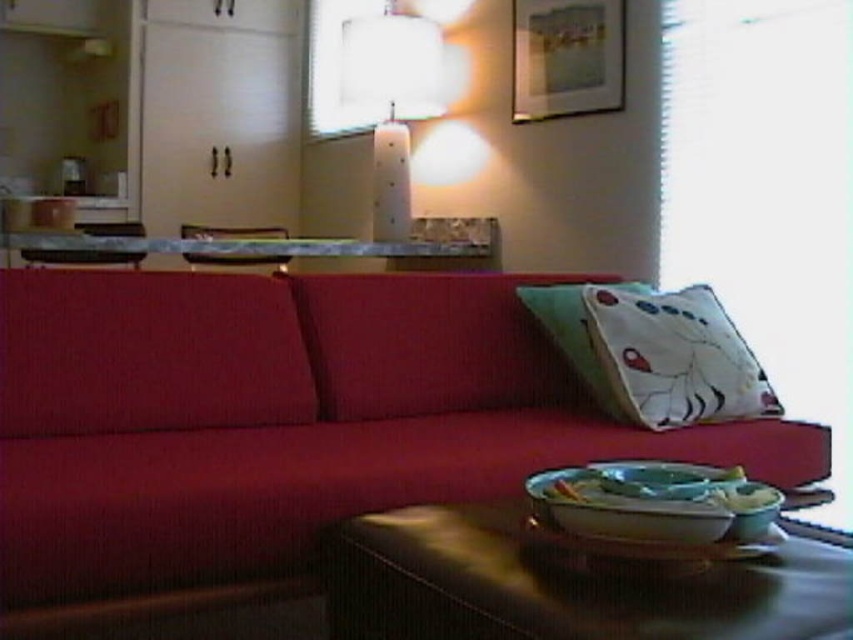
Which of these two, metallic silver table at center or white cotton pillow at right, stands taller?

white cotton pillow at right is taller.

Does point (486, 248) lie in front of point (601, 362)?

No, it is behind (601, 362).

Locate an element on the screen. This screenshot has height=640, width=853. metallic silver table at center is located at coordinates (242, 246).

Does velvet red couch at center lie behind white glossy lamp at upper center?

No, velvet red couch at center is in front of white glossy lamp at upper center.

Who is positioned more to the left, velvet red couch at center or white glossy lamp at upper center?

From the viewer's perspective, white glossy lamp at upper center appears more on the left side.

Which is behind, point (55, 499) or point (428, 74)?

Positioned behind is point (428, 74).

Where is `velvet red couch at center`? Image resolution: width=853 pixels, height=640 pixels. velvet red couch at center is located at coordinates (282, 420).

Who is positioned more to the right, velvet red couch at center or white cotton pillow at right?

white cotton pillow at right

Is point (418, 349) farther from viewer compared to point (558, 285)?

That is False.

Locate an element on the screen. The width and height of the screenshot is (853, 640). velvet red couch at center is located at coordinates (282, 420).